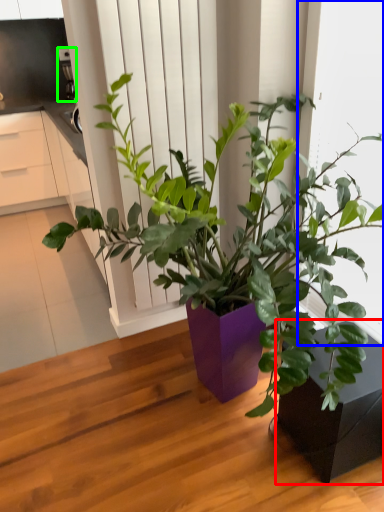
Question: Which object is positioned closest to flowerpot (highlighted by a red box)? Select from window frame (highlighted by a blue box) and appliance (highlighted by a green box).

Choices:
 (A) window frame
 (B) appliance

Answer: (A)